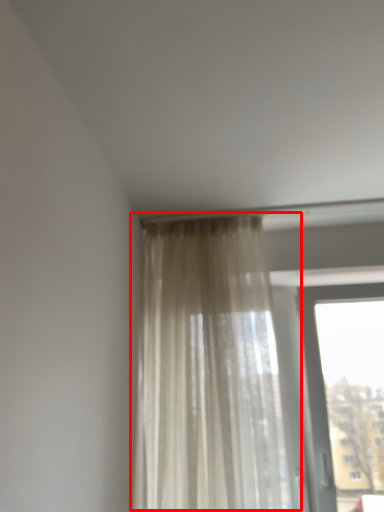
Question: From the image's perspective, considering the relative positions of curtain (annotated by the red box) and window in the image provided, where is curtain (annotated by the red box) located with respect to the staircase?

Choices:
 (A) below
 (B) above

Answer: (B)